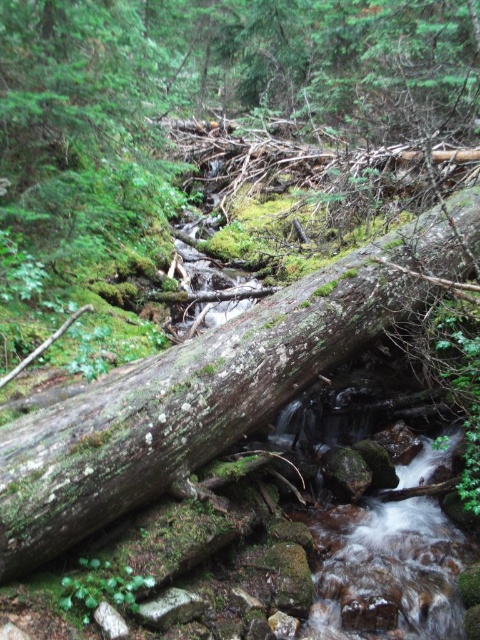
Can you confirm if green mossy log at center is thinner than clear water at stream center?

No.

Does green mossy log at center appear on the left side of clear water at stream center?

Yes, green mossy log at center is to the left of clear water at stream center.

What do you see at coordinates (211, 388) in the screenshot? I see `green mossy log at center` at bounding box center [211, 388].

Where is `green mossy log at center`? green mossy log at center is located at coordinates (211, 388).